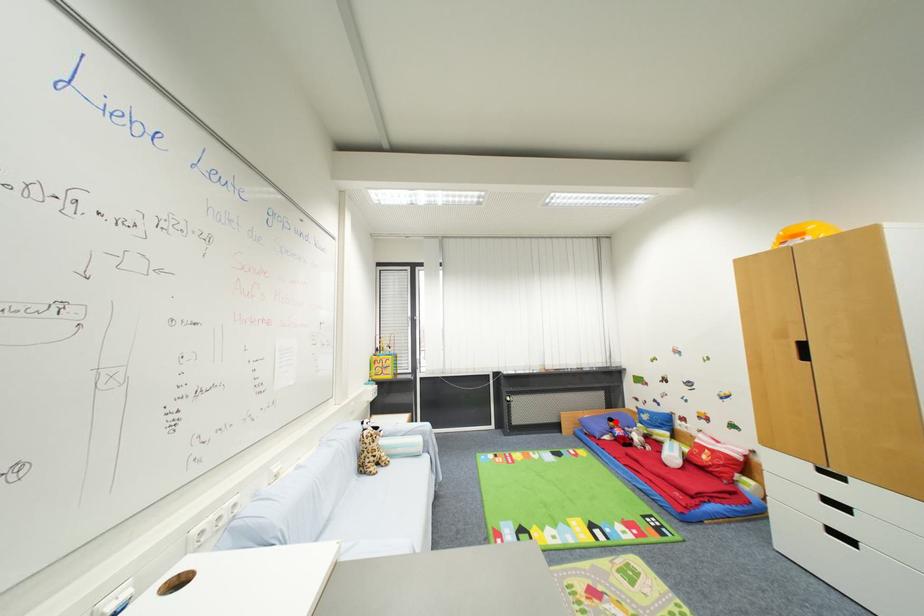
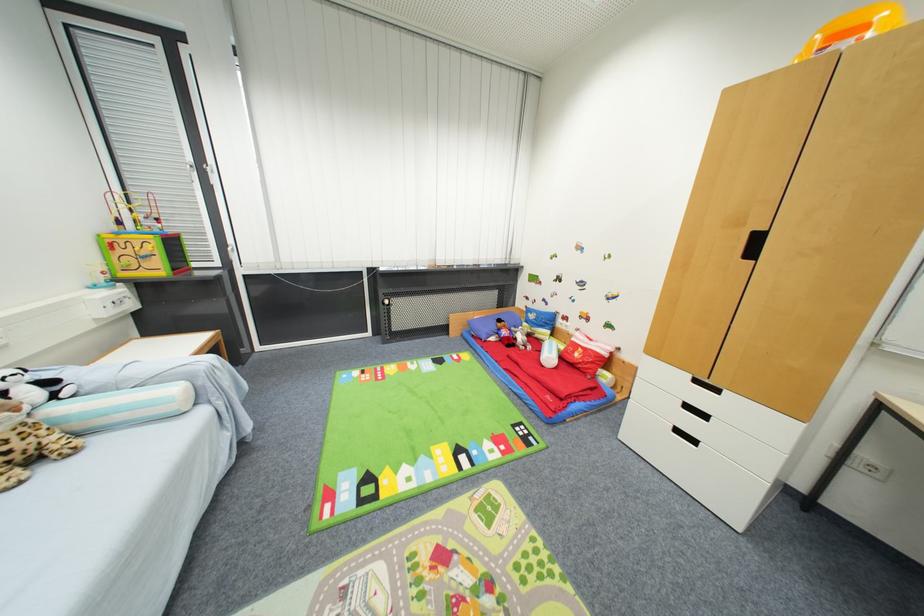
In the second image, find the point that corresponds to the highlighted location in the first image.

(505, 323)